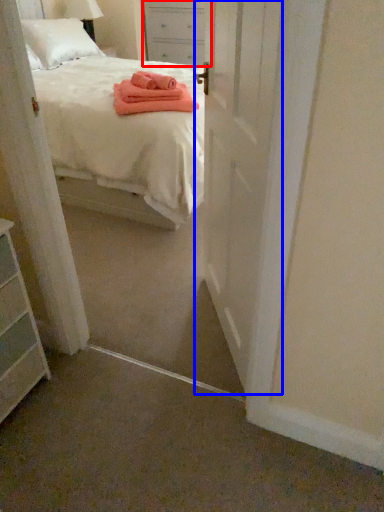
Question: Among these objects, which one is nearest to the camera, nightstand (highlighted by a red box) or door (highlighted by a blue box)?

Choices:
 (A) nightstand
 (B) door

Answer: (B)